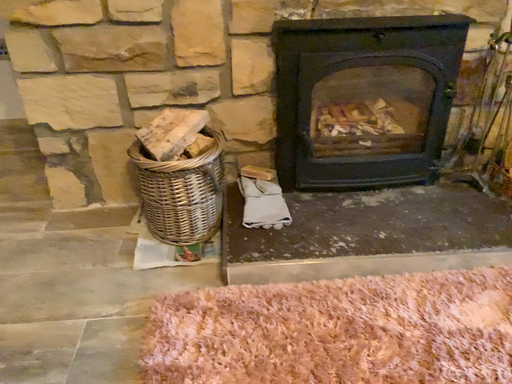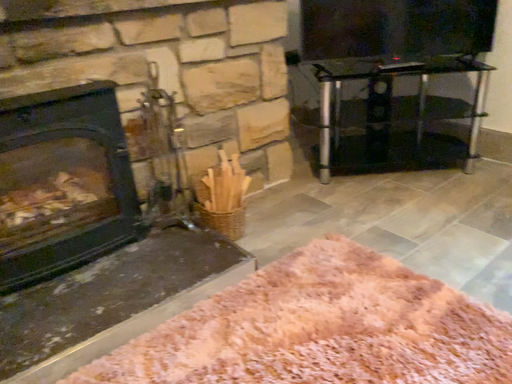
Question: How did the camera likely rotate when shooting the video?

Choices:
 (A) rotated left
 (B) rotated right

Answer: (B)